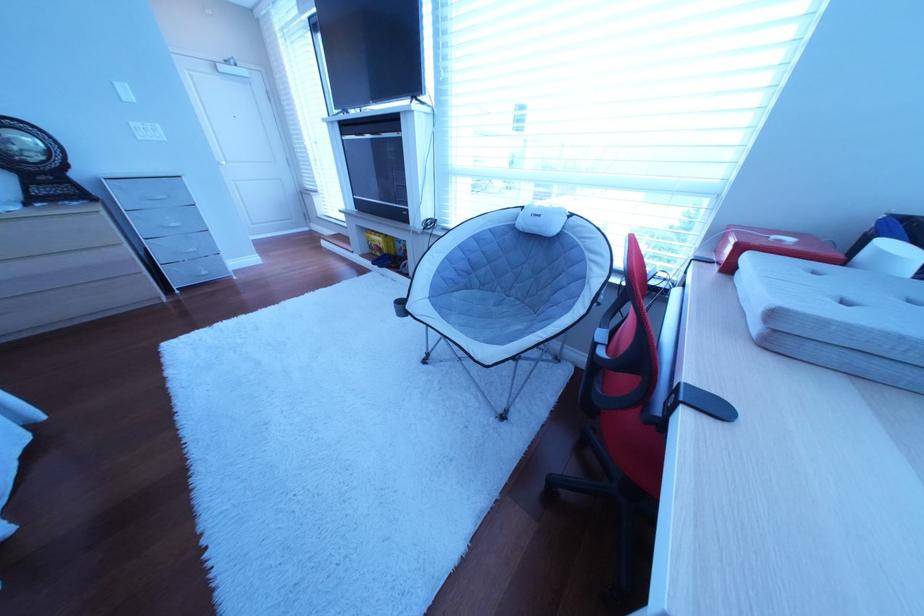
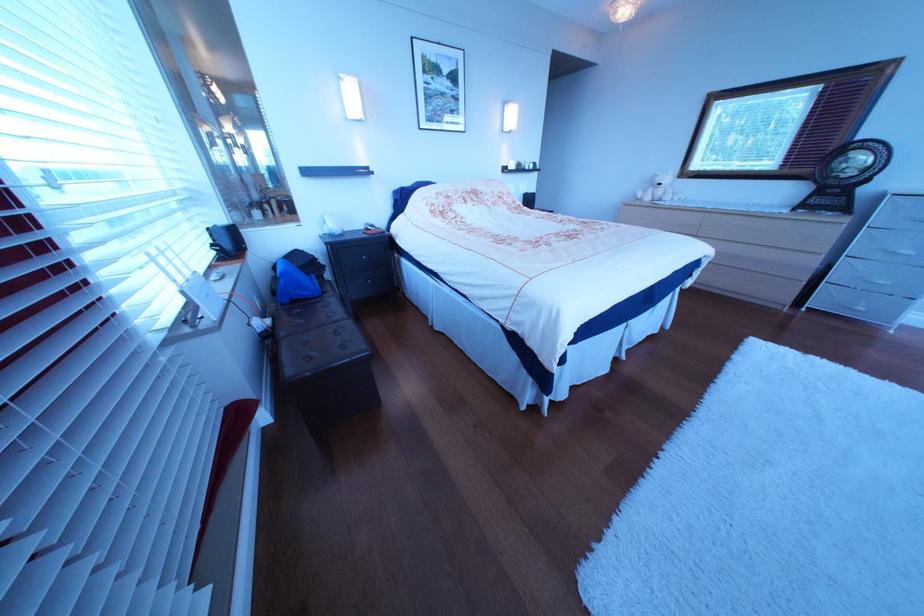
The images are taken continuously from a first-person perspective. In which direction is your viewpoint rotating?

The rotation direction of the camera is left-down.